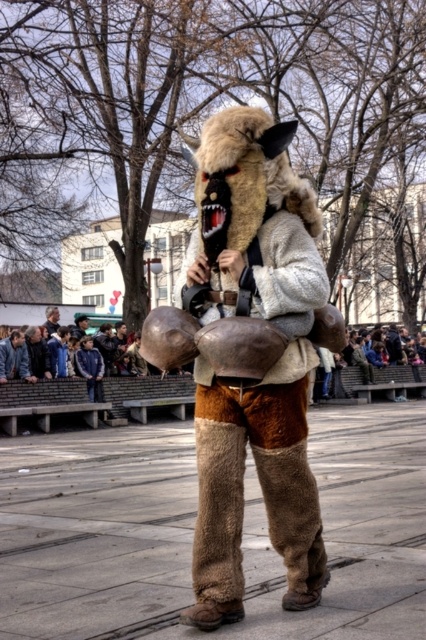
You are standing at the camera position and want to throw a ball to the point marked as point (213, 497). If the ball travels in a straight line, how far will it have to travel?

The ball will have to travel 4.77 meters to reach point (213, 497) from the camera position.